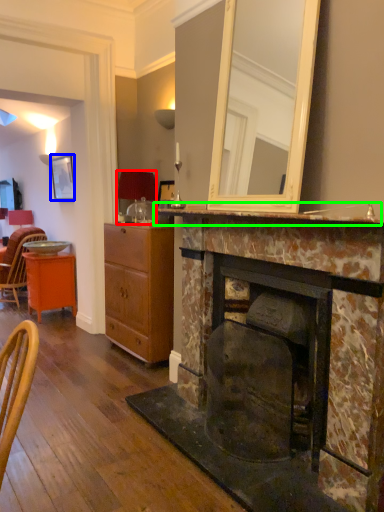
Question: Which object is positioned farthest from lamp (highlighted by a red box)? Select from picture frame (highlighted by a blue box) and mantle (highlighted by a green box).

Choices:
 (A) picture frame
 (B) mantle

Answer: (B)